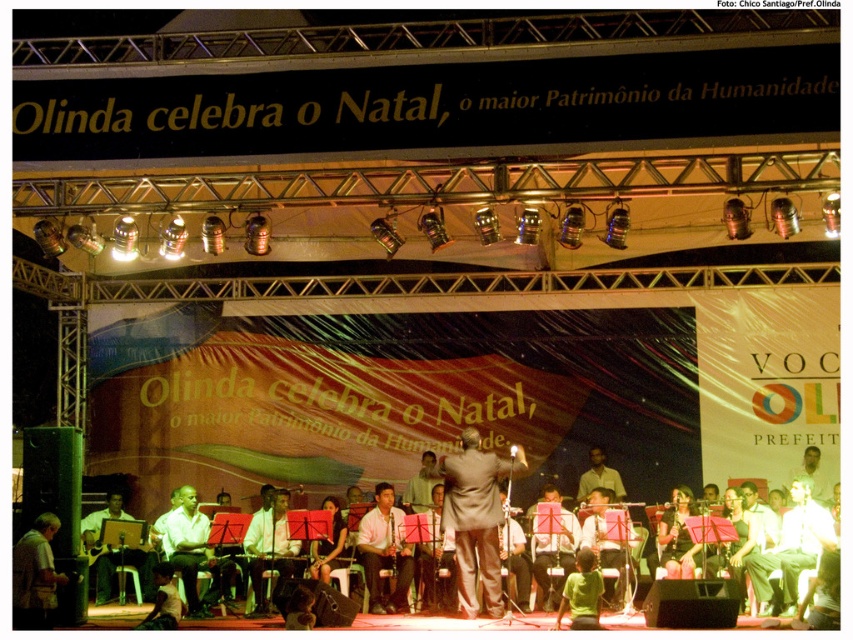
You are a photographer at the event and want to capture both the smooth brown saxophone at center and the light brown wood drum at center in a single shot. Which instrument should you focus on first to ensure both are in frame?

The light brown wood drum at center is behind the smooth brown saxophone at center, so you should focus on the smooth brown saxophone at center first to ensure both are in frame.

You are a photographer positioned at the front of the stage. You want to take a photo of the smooth brown saxophone at center without any obstructions. Is the light brown wood chair at lower left blocking your view of the saxophone?

The light brown wood chair at lower left is behind the smooth brown saxophone at center, so it won not block your view of the saxophone.

You are a photographer at the event and want to capture a photo of the smooth brown saxophone at center and the light brown wood chair at lower left. Which object is positioned higher in the frame?

The smooth brown saxophone at center is located above the light brown wood chair at lower left, so it is positioned higher in the frame.